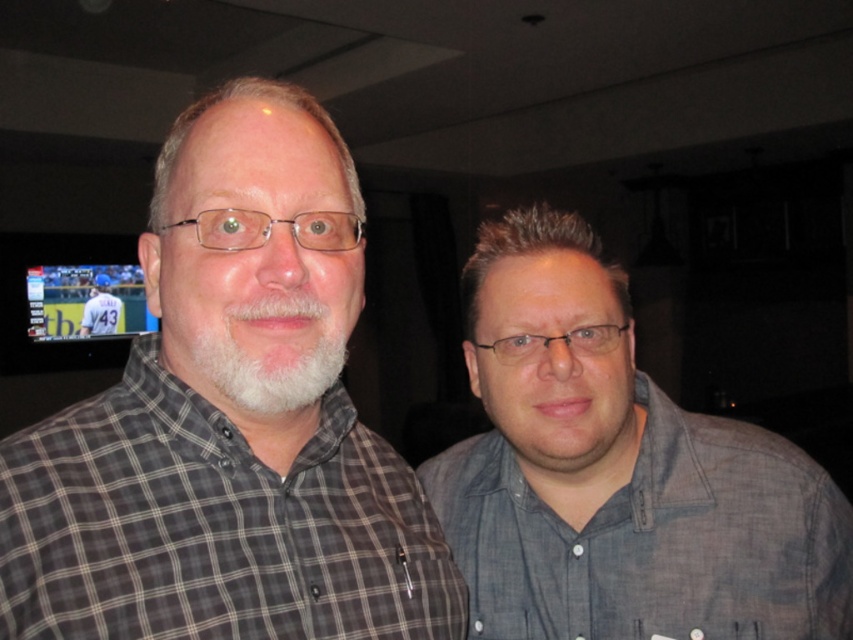
You are a photographer trying to capture a photo of the two shirts in the scene. From your current position, which shirt, the plaid cotton shirt at left or the gray checkered shirt at center, is positioned lower in the frame?

The plaid cotton shirt at left is positioned lower in the frame since it is below the gray checkered shirt at center.

You are a tailor measuring shirts for alterations. You have a plaid cotton shirt at left and a gray checkered shirt at center. Which shirt requires a wider alteration measurement?

The plaid cotton shirt at left requires a wider alteration measurement because its width is larger than the gray checkered shirt at center.

You are a photographer standing 10 feet away from the two people in the scene. You want to take a photo of both the plaid cotton shirt at left and the gray cotton shirt at right in the same frame. Can you fit both shirts into your camera frame without moving closer or farther away?

The plaid cotton shirt at left and gray cotton shirt at right are 9.90 inches apart from each other. Since the photographer is 10 feet away, the distance between the shirts is small enough to fit within the camera frame without needing to adjust distance.